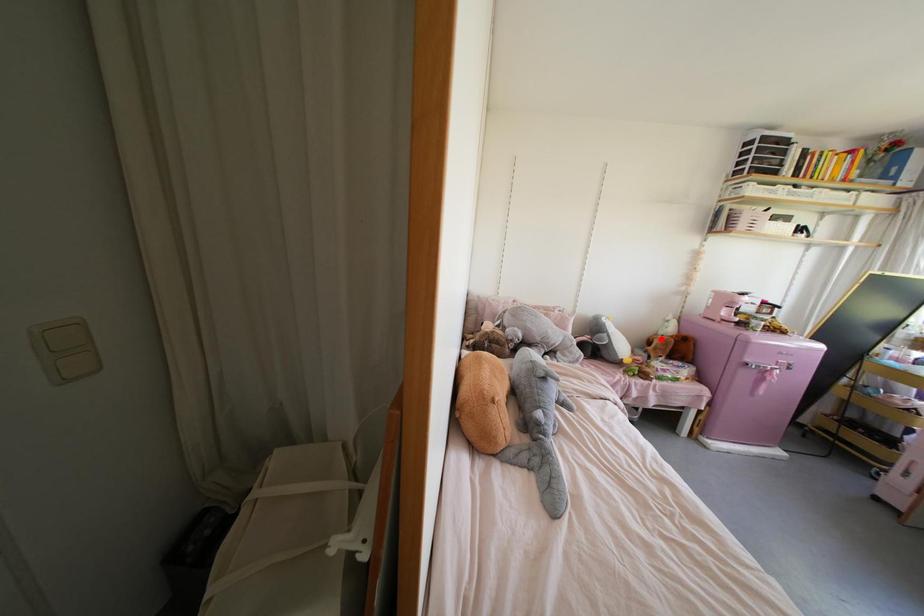
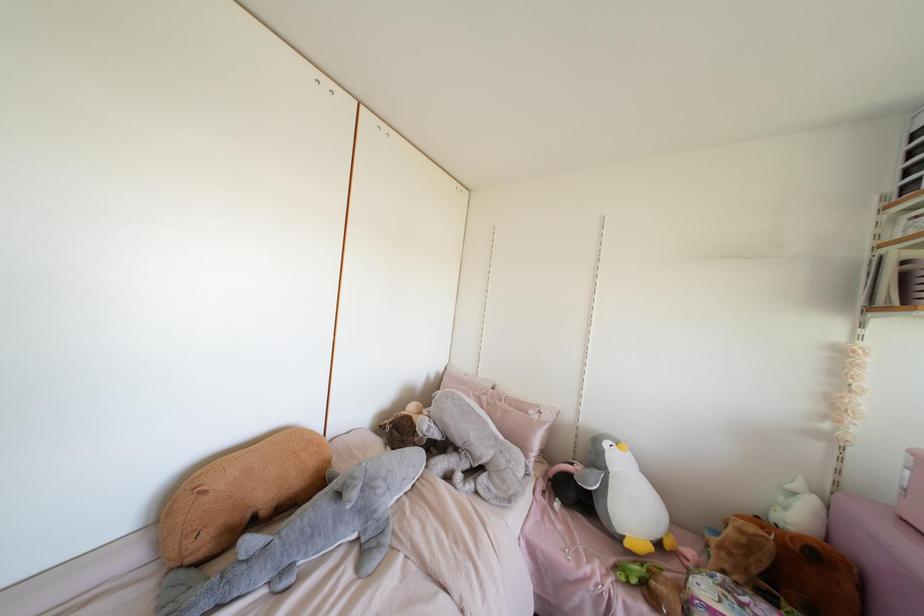
Where in the second image is the point corresponding to the highlighted location from the first image?

(739, 531)